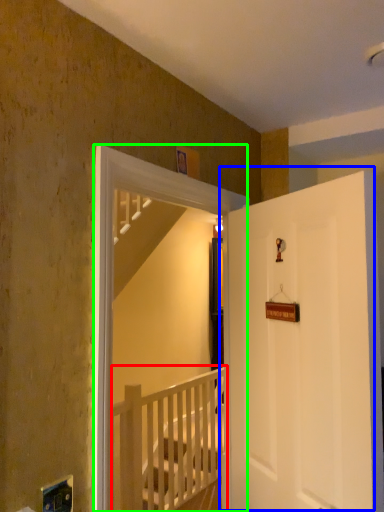
Question: Based on their relative distances, which object is farther from rail (highlighted by a red box)? Choose from door (highlighted by a blue box) and screen door (highlighted by a green box).

Choices:
 (A) door
 (B) screen door

Answer: (B)